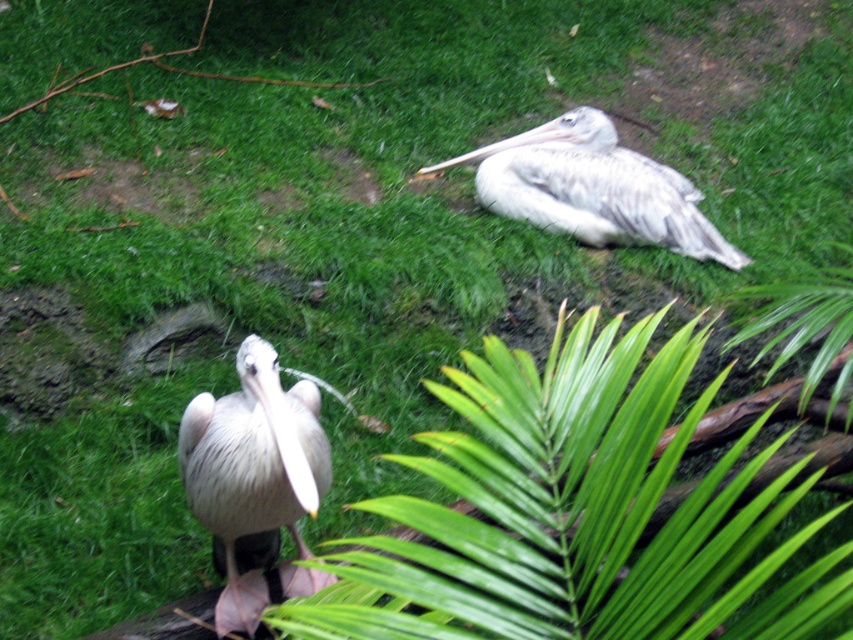
Is white feathered pelican at center above white feathered pelican at upper right?

No.

Is white feathered pelican at center bigger than white feathered pelican at upper right?

No.

Is point (248, 611) positioned in front of point (514, 198)?

That is True.

I want to click on white feathered pelican at center, so click(252, 468).